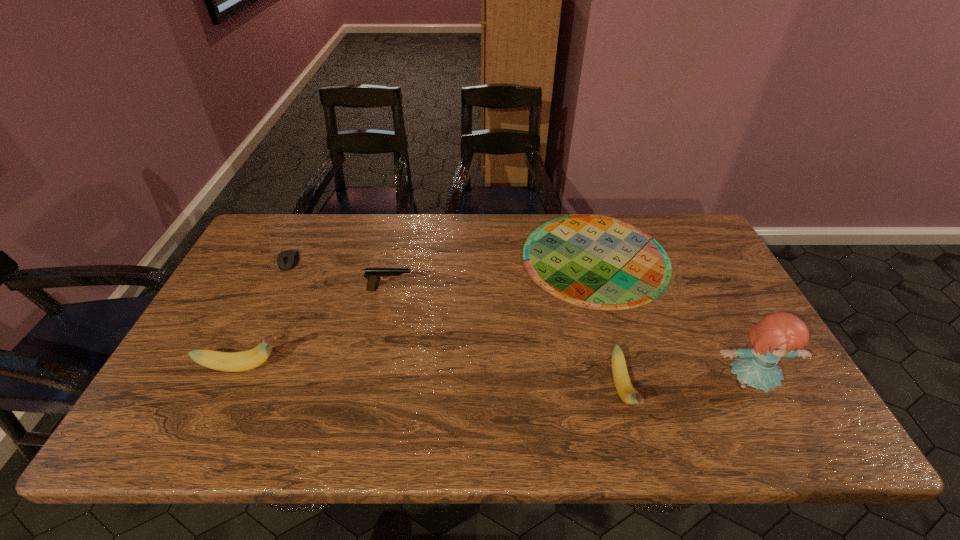
Where is `object present at the far right corner`? The width and height of the screenshot is (960, 540). object present at the far right corner is located at coordinates (596, 262).

You are a GUI agent. You are given a task and a screenshot of the screen. Output one action in this format:
    pyautogui.click(x=<x>, y=<y>)
    Task: Click on the object that is positioned at the near right corner
    
    Given the screenshot: What is the action you would take?
    pyautogui.click(x=778, y=335)

Image resolution: width=960 pixels, height=540 pixels. In the image, there is a desktop. Identify the location of free region at the far edge. (396, 238).

In the image, there is a desktop. At what (x,y) coordinates should I click in order to perform the action: click on free region at the near edge. Please return your answer as a coordinate pair (x, y). This screenshot has height=540, width=960. Looking at the image, I should click on (501, 403).

In the image, there is a desktop. Where is `free region at the left edge`? Image resolution: width=960 pixels, height=540 pixels. free region at the left edge is located at coordinates (277, 271).

Where is `blank space at the right edge of the desktop`? This screenshot has height=540, width=960. blank space at the right edge of the desktop is located at coordinates (698, 313).

Locate an element on the screen. vacant space at the far left corner of the desktop is located at coordinates (266, 227).

You are a GUI agent. You are given a task and a screenshot of the screen. Output one action in this format:
    pyautogui.click(x=<x>, y=<y>)
    Task: Click on the empty space between the computer equipment and the fourth object from right to left
    
    Given the screenshot: What is the action you would take?
    pyautogui.click(x=340, y=275)

The height and width of the screenshot is (540, 960). I want to click on free spot between the second shortest object and the third object from left to right, so click(x=340, y=275).

The width and height of the screenshot is (960, 540). What are the coordinates of `vacant point located between the shorter banana and the second tallest object` in the screenshot? It's located at (433, 378).